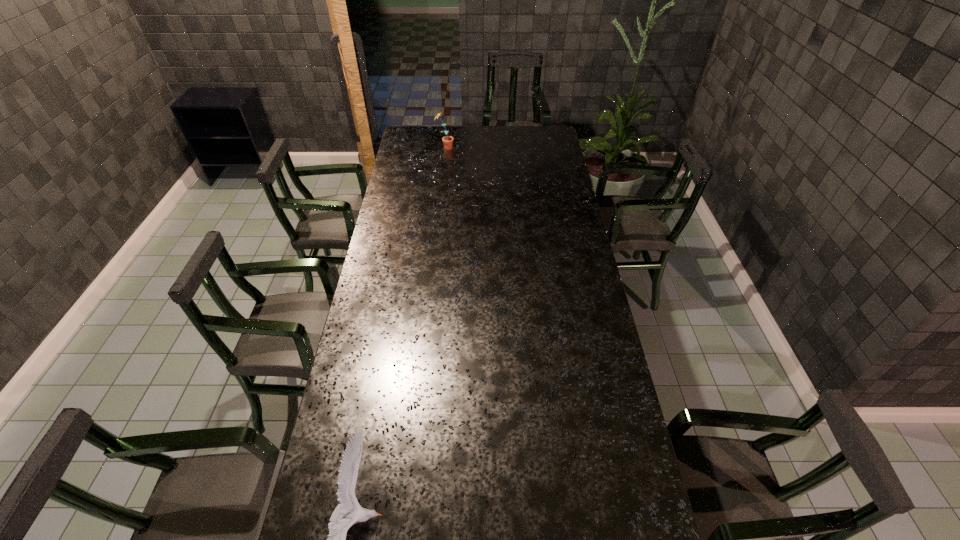
The width and height of the screenshot is (960, 540). Find the location of `the farther object`. the farther object is located at coordinates (447, 140).

Where is `vacant space located 0.050m on the flower of the sunflower`? This screenshot has width=960, height=540. vacant space located 0.050m on the flower of the sunflower is located at coordinates (464, 147).

At what (x,y) coordinates should I click in order to perform the action: click on object present at the far edge. Please return your answer as a coordinate pair (x, y). Looking at the image, I should click on (447, 140).

In the image, there is a desktop. Where is `blank space at the far edge`? blank space at the far edge is located at coordinates (499, 130).

Where is `free space at the left edge of the desktop`? The width and height of the screenshot is (960, 540). free space at the left edge of the desktop is located at coordinates (372, 415).

In the image, there is a desktop. Identify the location of free space at the right edge. The image size is (960, 540). (540, 149).